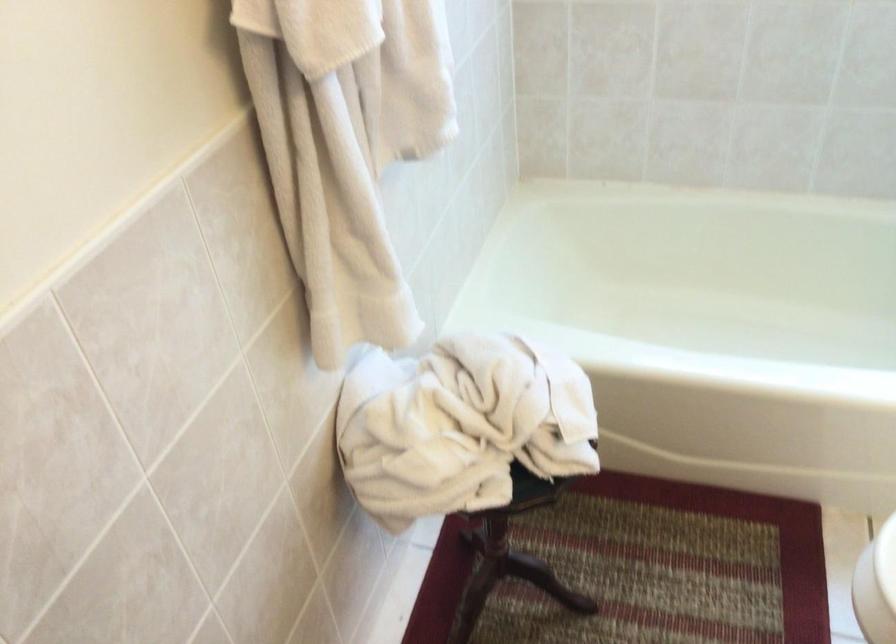
Identify the location of white bathtub rim. (698, 283).